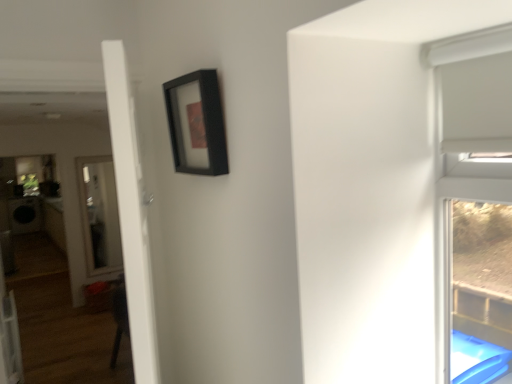
Question: In terms of height, does black matte picture frame at upper center look taller or shorter compared to white glossy door at left?

Choices:
 (A) short
 (B) tall

Answer: (A)

Question: Would you say black matte picture frame at upper center is to the left or to the right of white glossy door at left in the picture?

Choices:
 (A) right
 (B) left

Answer: (A)

Question: Is black matte picture frame at upper center situated inside white glossy door at left or outside?

Choices:
 (A) inside
 (B) outside

Answer: (B)

Question: Based on their positions, is white glossy door at left located to the left or right of black matte picture frame at upper center?

Choices:
 (A) left
 (B) right

Answer: (A)

Question: Is point (x=133, y=274) closer or farther from the camera than point (x=181, y=135)?

Choices:
 (A) farther
 (B) closer

Answer: (B)

Question: Based on their sizes in the image, would you say white glossy door at left is bigger or smaller than black matte picture frame at upper center?

Choices:
 (A) small
 (B) big

Answer: (B)

Question: Choose the correct answer: Is white glossy door at left inside black matte picture frame at upper center or outside it?

Choices:
 (A) outside
 (B) inside

Answer: (A)